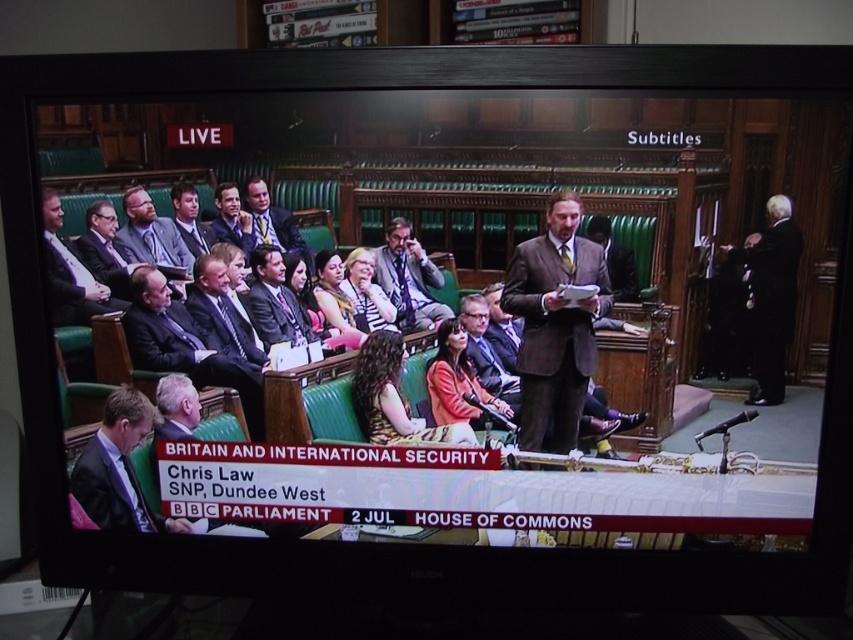
Is black suit at right taller than matte gray suit at left?

Yes, black suit at right is taller than matte gray suit at left.

Between black suit at right and matte gray suit at left, which one has more height?

black suit at right

What do you see at coordinates (770, 296) in the screenshot? I see `black suit at right` at bounding box center [770, 296].

Locate an element on the screen. The height and width of the screenshot is (640, 853). black suit at right is located at coordinates (770, 296).

Is the position of matte gray suit at center less distant than that of matte gray suit at left?

Yes, it is in front of matte gray suit at left.

Which of these two, matte gray suit at center or matte gray suit at left, stands shorter?

Standing shorter between the two is matte gray suit at left.

What do you see at coordinates (409, 278) in the screenshot? The width and height of the screenshot is (853, 640). I see `matte gray suit at center` at bounding box center [409, 278].

The image size is (853, 640). In order to click on matte gray suit at center in this screenshot , I will do `click(409, 278)`.

Is point (108, 500) less distant than point (96, 291)?

No.

Does dark suit at lower left have a smaller size compared to matte black suit at left?

No.

At what (x,y) coordinates should I click in order to perform the action: click on dark suit at lower left. Please return your answer as a coordinate pair (x, y). This screenshot has width=853, height=640. Looking at the image, I should click on click(x=119, y=467).